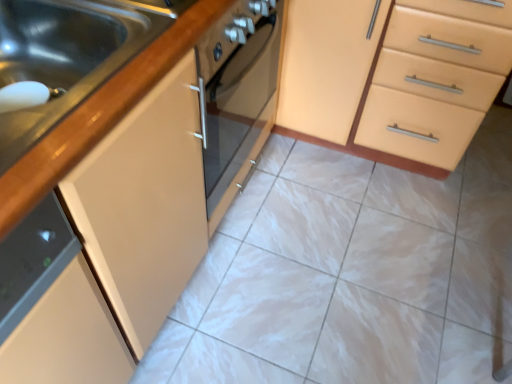
Question: Is point (348, 74) closer or farther from the camera than point (180, 39)?

Choices:
 (A) farther
 (B) closer

Answer: (A)

Question: From a real-world perspective, is matte beige cabinet at center positioned above or below brushed metal sink at left?

Choices:
 (A) below
 (B) above

Answer: (A)

Question: Considering the positions of matte beige cabinet at center and brushed metal sink at left in the image, is matte beige cabinet at center wider or thinner than brushed metal sink at left?

Choices:
 (A) wide
 (B) thin

Answer: (A)

Question: Considering their positions, is brushed metal sink at left located in front of or behind matte beige cabinet at center?

Choices:
 (A) front
 (B) behind

Answer: (A)

Question: From a real-world perspective, is brushed metal sink at left positioned above or below matte beige cabinet at center?

Choices:
 (A) below
 (B) above

Answer: (B)

Question: Does point (3, 225) appear closer or farther from the camera than point (428, 107)?

Choices:
 (A) farther
 (B) closer

Answer: (B)

Question: Based on their sizes in the image, would you say brushed metal sink at left is bigger or smaller than matte beige cabinet at center?

Choices:
 (A) small
 (B) big

Answer: (A)